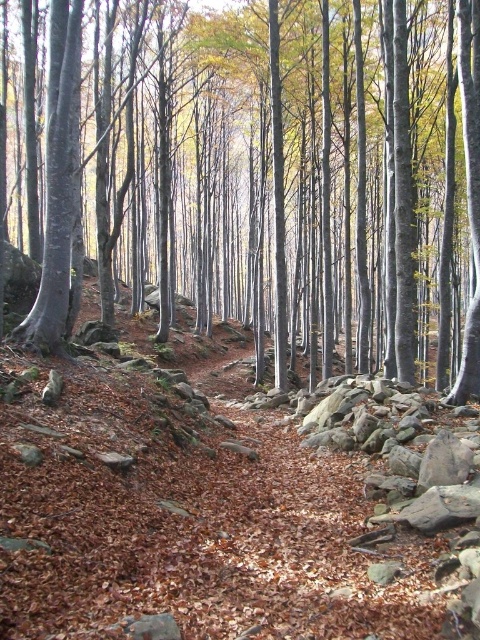
Between brown wood forest at center and brown leafy hillside at center, which one has less height?

With less height is brown leafy hillside at center.

Can you confirm if brown wood forest at center is positioned to the right of brown leafy hillside at center?

No, brown wood forest at center is not to the right of brown leafy hillside at center.

What do you see at coordinates (267, 173) in the screenshot?
I see `brown wood forest at center` at bounding box center [267, 173].

You are a GUI agent. You are given a task and a screenshot of the screen. Output one action in this format:
    pyautogui.click(x=<x>, y=<y>)
    Task: Click on the brown wood forest at center
    This screenshot has width=480, height=640.
    Given the screenshot: What is the action you would take?
    pyautogui.click(x=267, y=173)